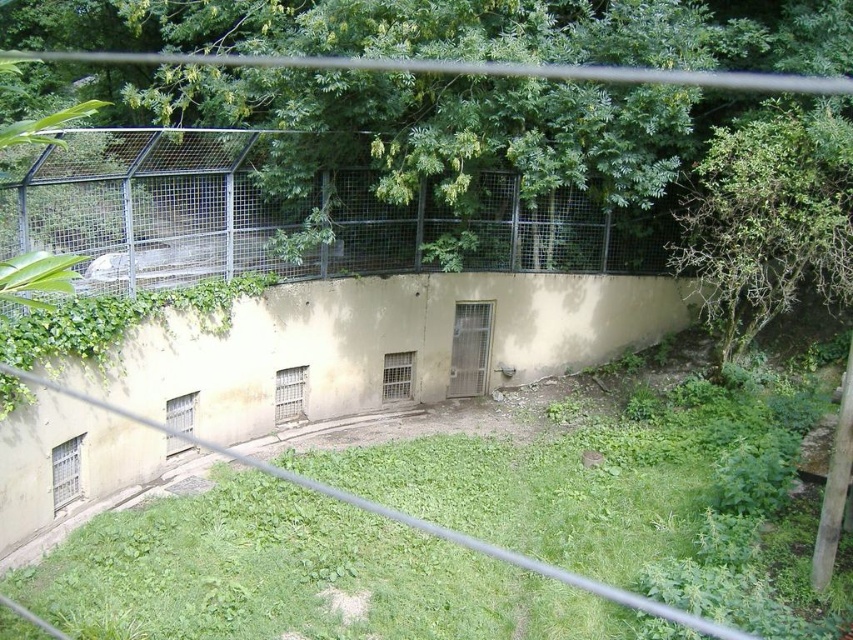
In the scene shown: You are a zookeeper who wants to trim the branches of the green leafy tree at upper right and the green grass at lower center. Which object is located to the right of the other?

The green leafy tree at upper right is positioned on the right side of green grass at lower center.

You are a zookeeper who wants to ensure the safety of the animals. You notice the metal mesh fence at upper center and the green grass at lower center. Which object is shorter and might need checking for potential escape routes?

The metal mesh fence at upper center is shorter than the green grass at lower center, so it might need checking for potential escape routes because it is shorter and could allow animals to escape.